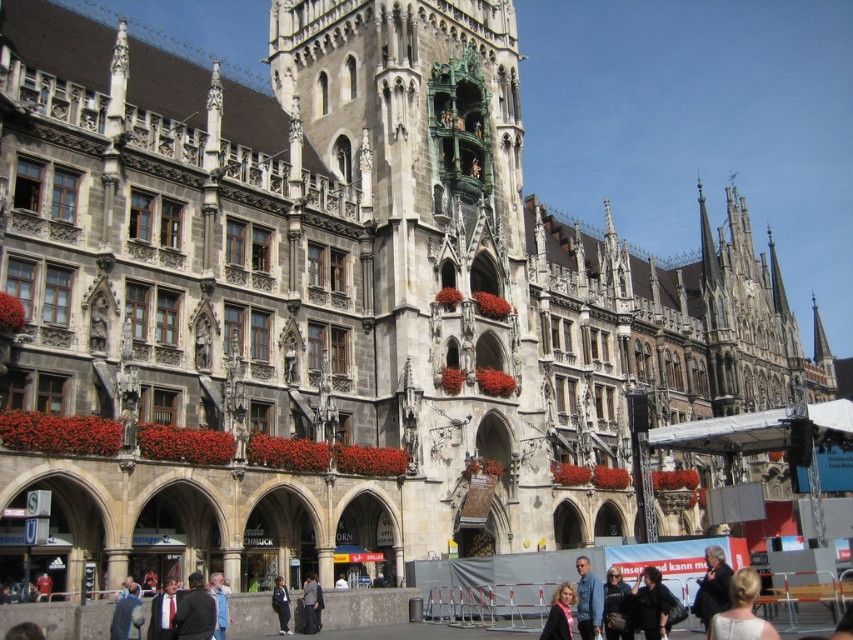
Question: Can you confirm if dark gray suit at lower right is positioned to the left of dark gray suit at center?

Choices:
 (A) no
 (B) yes

Answer: (A)

Question: Can you confirm if matte black jacket at lower center is bigger than dark gray suit at center?

Choices:
 (A) no
 (B) yes

Answer: (B)

Question: Is the position of dark suit at center more distant than that of black fabric jacket at lower center?

Choices:
 (A) yes
 (B) no

Answer: (B)

Question: Which point is closer to the camera?

Choices:
 (A) (715, 609)
 (B) (755, 586)

Answer: (B)

Question: Estimate the real-world distances between objects in this image. Which object is closer to the blue denim jacket at lower right?

Choices:
 (A) matte black jacket at lower center
 (B) dark suit at center
 (C) dark gray jacket at center
 (D) white fabric dress at lower right

Answer: (A)

Question: Which object appears closest to the camera in this image?

Choices:
 (A) dark gray jacket at lower center
 (B) dark gray jacket at center
 (C) matte black jacket at lower center
 (D) dark gray suit at lower right

Answer: (C)